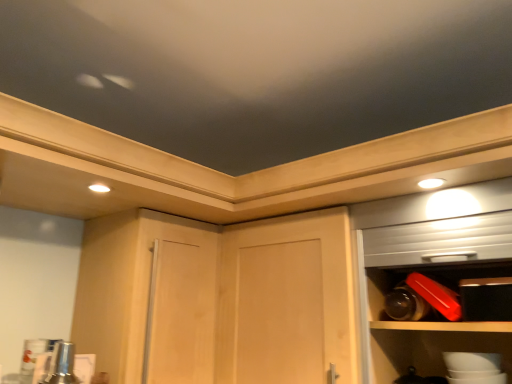
What is the approximate width of light wood cupboard at center?

72.29 centimeters.

Describe the element at coordinates (219, 298) in the screenshot. I see `light wood cupboard at center` at that location.

Locate an element on the screen. light wood cupboard at center is located at coordinates (219, 298).

Find the location of a particular element. light wood cupboard at center is located at coordinates (219, 298).